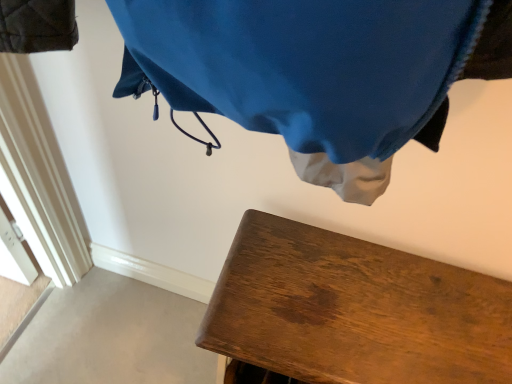
The width and height of the screenshot is (512, 384). I want to click on free space above wooden bench at lower right (from a real-world perspective), so click(x=392, y=307).